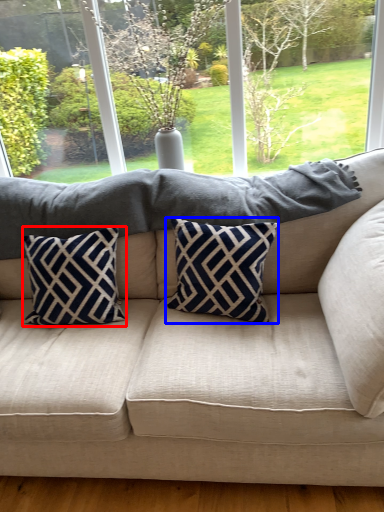
Question: Which object is closer to the camera taking this photo, pillow (highlighted by a red box) or pillow (highlighted by a blue box)?

Choices:
 (A) pillow
 (B) pillow

Answer: (B)